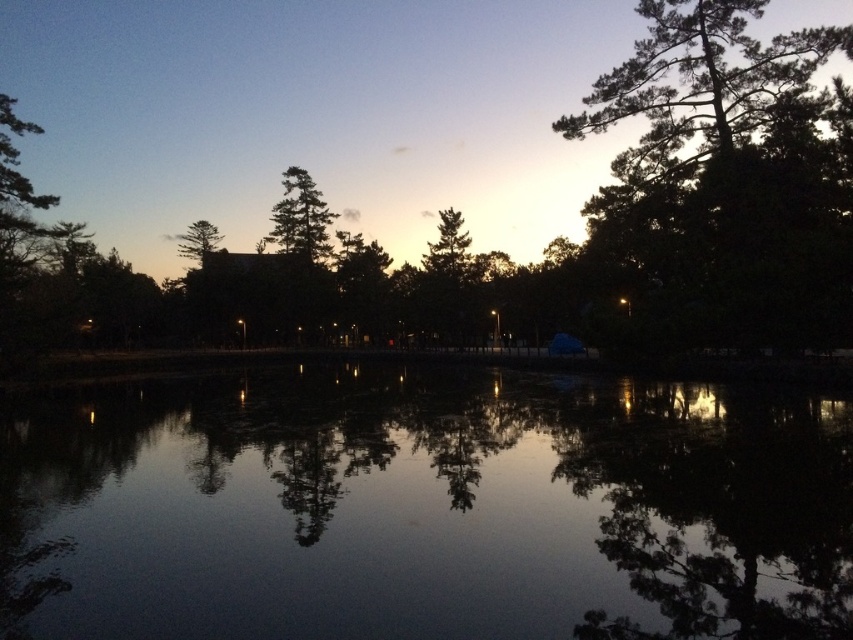
Can you confirm if black reflective water at center is positioned below green matte tree at upper center?

Yes.

Does black reflective water at center appear on the right side of green matte tree at upper center?

Indeed, black reflective water at center is positioned on the right side of green matte tree at upper center.

Find the location of `black reflective water at center`. black reflective water at center is located at coordinates [x=422, y=508].

Locate an element on the screen. The image size is (853, 640). black reflective water at center is located at coordinates (422, 508).

Does black reflective water at center have a lesser height compared to green leafy tree at upper right?

Yes.

Is point (811, 408) positioned in front of point (712, 4)?

Yes, it is in front of point (712, 4).

This screenshot has height=640, width=853. Find the location of `black reflective water at center`. black reflective water at center is located at coordinates (422, 508).

In the scene shown: Which of these two, green leafy tree at upper right or green matte tree at upper center, stands taller?

With more height is green leafy tree at upper right.

Between point (740, 83) and point (294, 228), which one is positioned in front?

Point (740, 83) is more forward.

Image resolution: width=853 pixels, height=640 pixels. I want to click on green leafy tree at upper right, so click(x=723, y=170).